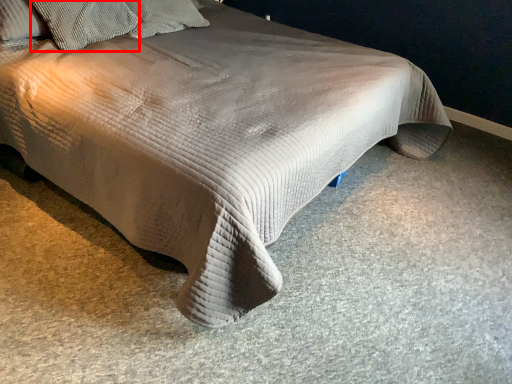
Question: From the image's perspective, what is the correct spatial relationship of pillow (annotated by the red box) in relation to pillow?

Choices:
 (A) below
 (B) above

Answer: (A)